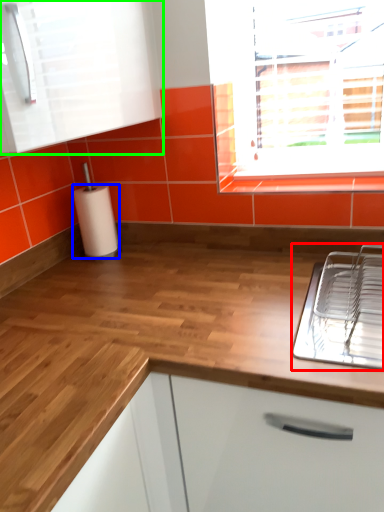
Question: Considering the real-world distances, which object is closest to appliance (highlighted by a red box)? paper towel (highlighted by a blue box) or cabinetry (highlighted by a green box).

Choices:
 (A) paper towel
 (B) cabinetry

Answer: (B)